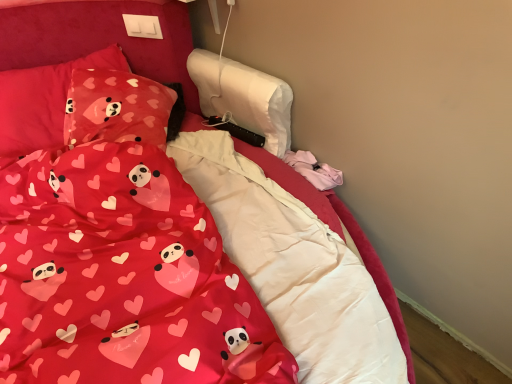
Locate an element on the screen. free space above matte pink fabric pillow at upper left, which is the second pillow in right-to-left order (from a real-world perspective) is located at coordinates (54, 69).